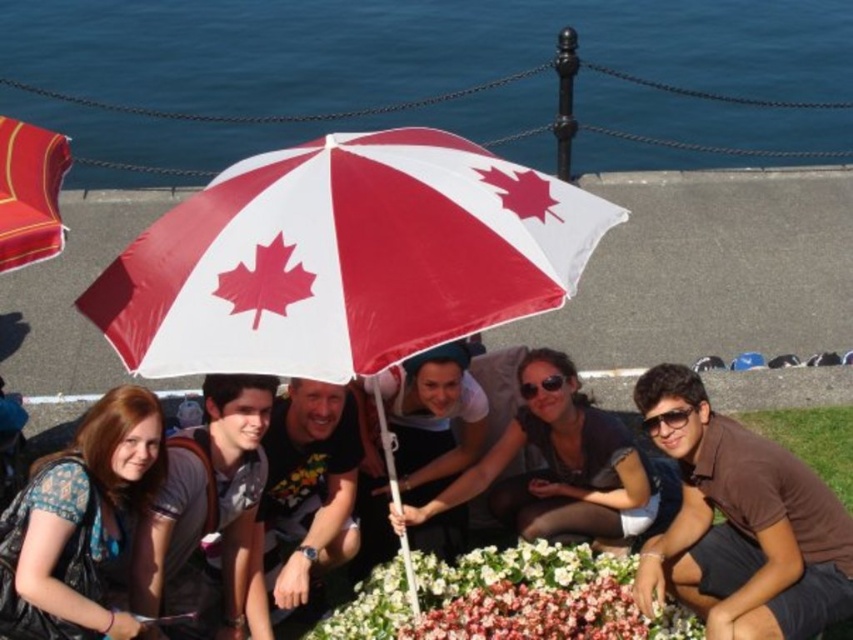
Does matte black shirt at center come in front of matte black backpack at lower left?

No, it is not.

Describe the element at coordinates (561, 467) in the screenshot. I see `matte black shirt at center` at that location.

Does point (631, 477) come behind point (166, 554)?

Yes.

Find the location of a particular element. The width and height of the screenshot is (853, 640). matte black shirt at center is located at coordinates (561, 467).

Which of these two, red and white fabric umbrella at center or patterned fabric shirt at lower left, stands taller?

Standing taller between the two is red and white fabric umbrella at center.

From the picture: Is red and white fabric umbrella at center wider than patterned fabric shirt at lower left?

Yes, red and white fabric umbrella at center is wider than patterned fabric shirt at lower left.

Locate an element on the screen. The height and width of the screenshot is (640, 853). red and white fabric umbrella at center is located at coordinates (344, 259).

The height and width of the screenshot is (640, 853). I want to click on red and white fabric umbrella at center, so click(344, 259).

Between blue water at upper center and floral fabric flower bed at center, which one has more height?

With more height is blue water at upper center.

Which is behind, point (128, 170) or point (461, 579)?

The point (128, 170) is behind.

In order to click on blue water at upper center in this screenshot , I will do `click(428, 77)`.